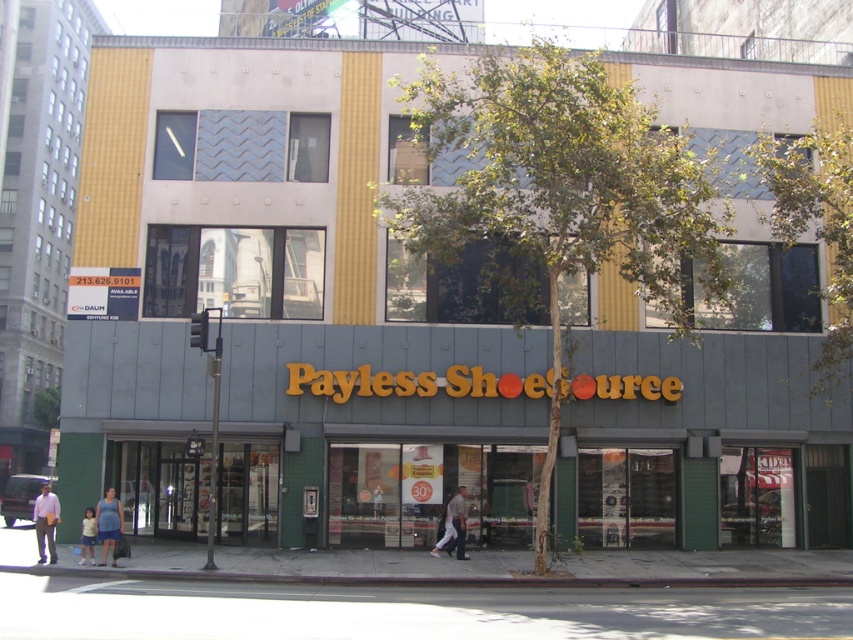
Which is behind, point (113, 506) or point (456, 518)?

The point (456, 518) is more distant.

Between point (112, 528) and point (437, 548), which one is positioned behind?

The point (437, 548) is behind.

Identify the location of blue denim shorts at lower center. (108, 524).

Is gray concrete sidewalk at lower center taller than light brown leather jacket at center?

In fact, gray concrete sidewalk at lower center may be shorter than light brown leather jacket at center.

You are a GUI agent. You are given a task and a screenshot of the screen. Output one action in this format:
    pyautogui.click(x=<x>, y=<y>)
    Task: Click on the gray concrete sidewalk at lower center
    
    Given the screenshot: What is the action you would take?
    pyautogui.click(x=468, y=566)

You are a GUI agent. You are given a task and a screenshot of the screen. Output one action in this format:
    pyautogui.click(x=<x>, y=<y>)
    Task: Click on the gray concrete sidewalk at lower center
    
    Given the screenshot: What is the action you would take?
    coord(468,566)

Looking at this image, who is more distant from viewer, (113, 376) or (451, 532)?

The point (113, 376) is behind.

Can you confirm if gray concrete storefront at center is bigger than light brown leather jacket at center?

Yes.

Is point (712, 534) farther from camera compared to point (450, 513)?

Yes.

Locate an element on the screen. gray concrete storefront at center is located at coordinates (390, 426).